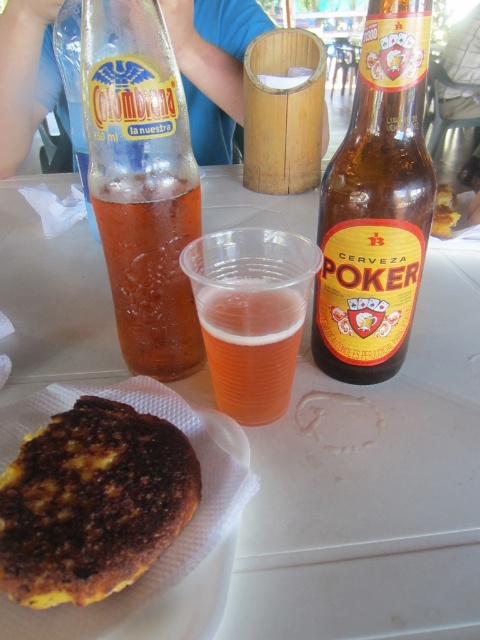
Consider the image. You are a photographer trying to capture the translucent glass bottle at upper left in focus. The camera can only focus on objects within 12 inches. Will the bottle be in focus?

The translucent glass bottle at upper left is 12.18 inches from camera, which is slightly beyond the camera focus range of 12 inches. Therefore, the bottle will not be in focus.

You are a waiter at an outdoor dining area. You need to place a new menu on the table between the brown glass bottle at upper center and the translucent plastic cup at center. Since the menu is 15 cm wide, will there be enough space between them?

The brown glass bottle at upper center is larger in size than the translucent plastic cup at center, but the exact distance between them isn not provided. However, since the menu is 15 cm wide, it might fit if the space between them is at least 15 cm. Without specific measurements, it is uncertain.